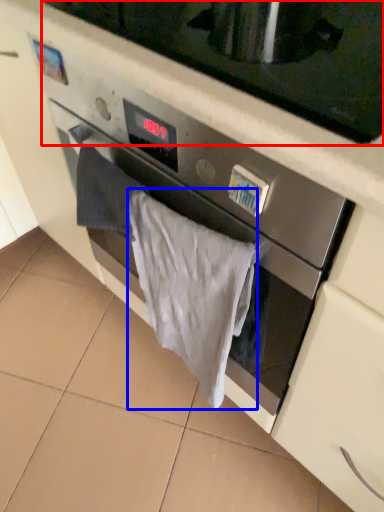
Question: Which object appears farthest to the camera in this image, microwave oven (highlighted by a red box) or bath towel (highlighted by a blue box)?

Choices:
 (A) microwave oven
 (B) bath towel

Answer: (B)